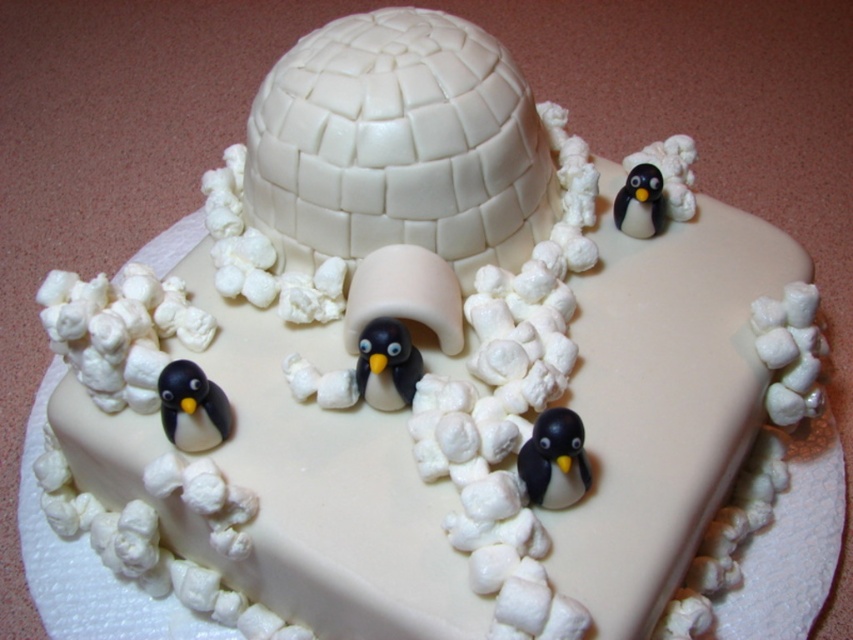
Question: Is black glossy penguin at lower center to the right of black matte penguin at lower left from the viewer's perspective?

Choices:
 (A) yes
 (B) no

Answer: (A)

Question: Estimate the real-world distances between objects in this image. Which object is farther from the black matte penguin at lower left?

Choices:
 (A) matte black penguin at center
 (B) black glossy penguin at lower center

Answer: (B)

Question: Based on their relative distances, which object is nearer to the black glossy penguin at upper right?

Choices:
 (A) matte black penguin at center
 (B) black glossy penguin at lower center

Answer: (A)

Question: Which point is closer to the camera?

Choices:
 (A) (386, 410)
 (B) (651, 204)
 (C) (544, 449)
 (D) (175, 396)

Answer: (C)

Question: Is black glossy penguin at lower center above black matte penguin at lower left?

Choices:
 (A) yes
 (B) no

Answer: (B)

Question: Is black matte penguin at lower left below matte black penguin at center?

Choices:
 (A) no
 (B) yes

Answer: (B)